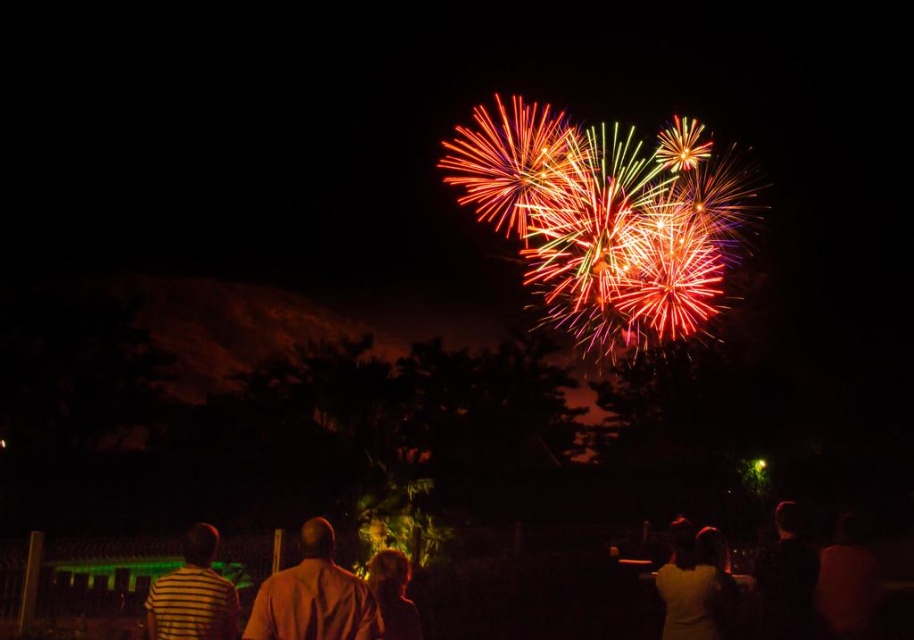
Is striped cotton shirt at lower left behind dark skin textured shirt at lower right?

No, striped cotton shirt at lower left is in front of dark skin textured shirt at lower right.

Can you confirm if striped cotton shirt at lower left is thinner than dark skin textured shirt at lower right?

Yes, striped cotton shirt at lower left is thinner than dark skin textured shirt at lower right.

Describe the element at coordinates (193, 595) in the screenshot. I see `striped cotton shirt at lower left` at that location.

Find the location of a particular element. Image resolution: width=914 pixels, height=640 pixels. striped cotton shirt at lower left is located at coordinates (193, 595).

Does point (721, 204) come in front of point (679, 605)?

No, it is behind (679, 605).

Which is in front, point (711, 292) or point (711, 604)?

Point (711, 604)

This screenshot has width=914, height=640. What are the coordinates of `multicolored sparkler at upper center` in the screenshot? It's located at (603, 218).

Can you confirm if brown matte shirt at center is positioned below yellow matte shirt at lower right?

No.

Who is positioned more to the left, brown matte shirt at center or yellow matte shirt at lower right?

brown matte shirt at center

Which is in front, point (311, 620) or point (720, 634)?

Point (311, 620)

This screenshot has height=640, width=914. Find the location of `brown matte shirt at center`. brown matte shirt at center is located at coordinates (314, 596).